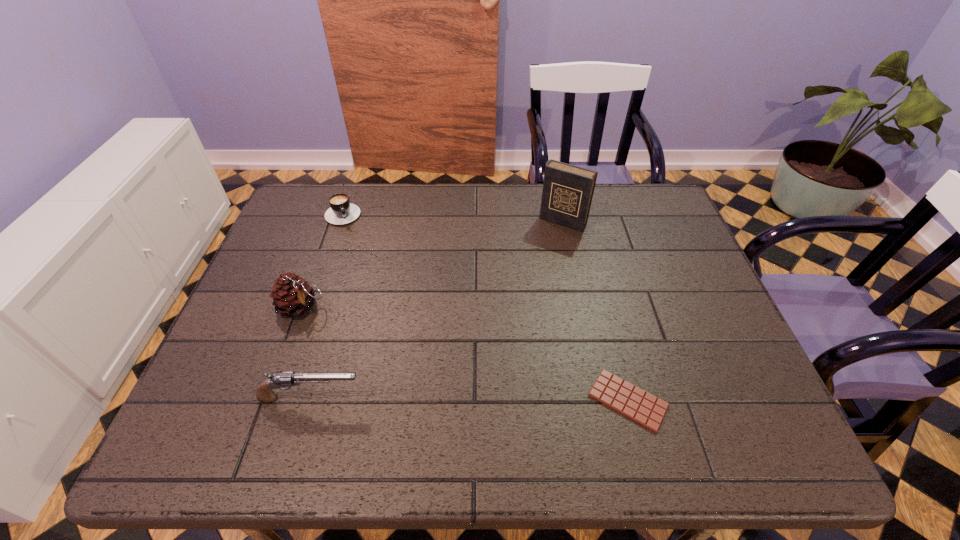
Locate an element on the screen. The width and height of the screenshot is (960, 540). gun is located at coordinates (264, 392).

The height and width of the screenshot is (540, 960). In order to click on candy bar in this screenshot , I will do `click(634, 403)`.

Find the location of a particular element. This screenshot has height=540, width=960. the third farthest object is located at coordinates click(292, 296).

Locate an element on the screen. Image resolution: width=960 pixels, height=540 pixels. the second tallest object is located at coordinates (292, 296).

This screenshot has height=540, width=960. I want to click on cappuccino, so click(341, 211).

At what (x,y) coordinates should I click in order to perform the action: click on diary. Please return your answer as a coordinate pair (x, y). This screenshot has height=540, width=960. Looking at the image, I should click on (567, 194).

Identify the location of vacant space located 0.340m aiming along the barrel of the third tallest object. (525, 398).

Locate an element on the screen. The height and width of the screenshot is (540, 960). free point located 0.380m on the left of the shortest object is located at coordinates (407, 400).

Find the location of a particular element. blank space located 0.300m with a leaf charm attached to the pinecone is located at coordinates (417, 372).

Where is `free space located with a leaf charm attached to the pinecone`? The image size is (960, 540). free space located with a leaf charm attached to the pinecone is located at coordinates (393, 357).